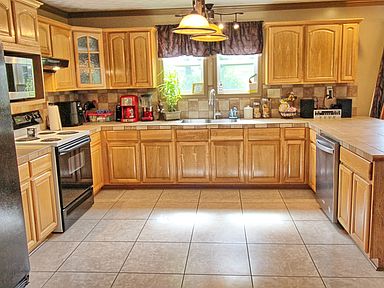
You are a GUI agent. You are given a task and a screenshot of the screen. Output one action in this format:
    pyautogui.click(x=<x>, y=<y>)
    Task: Click on the paper towels
    This screenshot has height=288, width=384.
    Given the screenshot: What is the action you would take?
    pyautogui.click(x=54, y=118)